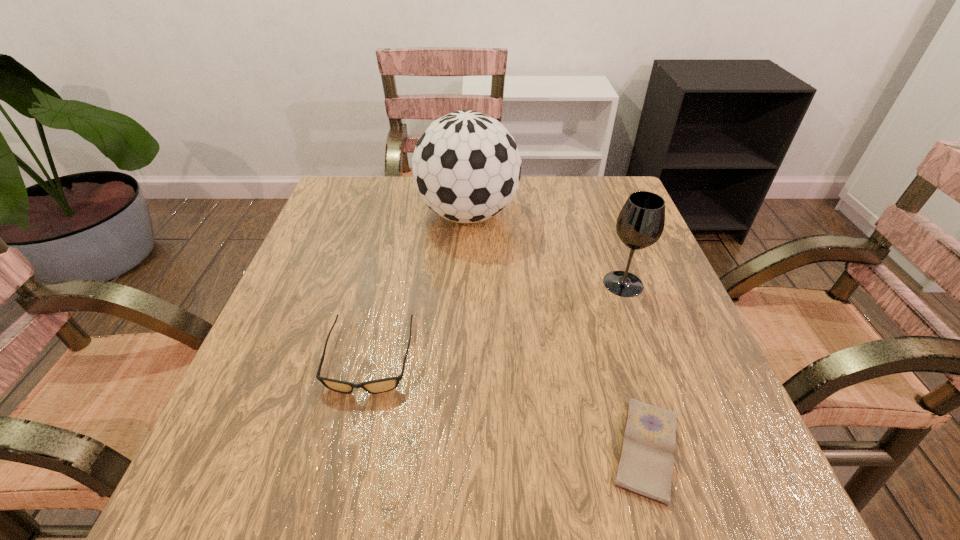
In the image, there is a desktop. In order to click on vacant space at the left edge in this screenshot , I will do `click(294, 450)`.

You are a GUI agent. You are given a task and a screenshot of the screen. Output one action in this format:
    pyautogui.click(x=<x>, y=<y>)
    Task: Click on the free spot at the right edge of the desktop
    The width and height of the screenshot is (960, 540).
    Given the screenshot: What is the action you would take?
    (x=639, y=314)

I want to click on blank space at the far left corner of the desktop, so click(x=380, y=213).

The width and height of the screenshot is (960, 540). In order to click on vacant region at the far right corner of the desktop in this screenshot , I will do `click(575, 190)`.

Locate an element on the screen. The width and height of the screenshot is (960, 540). vacant space at the near right corner of the desktop is located at coordinates (670, 503).

This screenshot has height=540, width=960. Find the location of `free space between the diary and the sunglasses`. free space between the diary and the sunglasses is located at coordinates (508, 404).

What are the coordinates of `free spot between the nearest object and the tallest object` in the screenshot? It's located at (557, 332).

Locate an element on the screen. unoccupied area between the second farthest object and the farthest object is located at coordinates (545, 249).

This screenshot has width=960, height=540. In order to click on free space between the nearest object and the sunglasses in this screenshot , I will do `click(508, 404)`.

You are a GUI agent. You are given a task and a screenshot of the screen. Output one action in this format:
    pyautogui.click(x=<x>, y=<y>)
    Task: Click on the free point between the farthest object and the wineglass
    Image resolution: width=960 pixels, height=540 pixels.
    Given the screenshot: What is the action you would take?
    pyautogui.click(x=545, y=249)